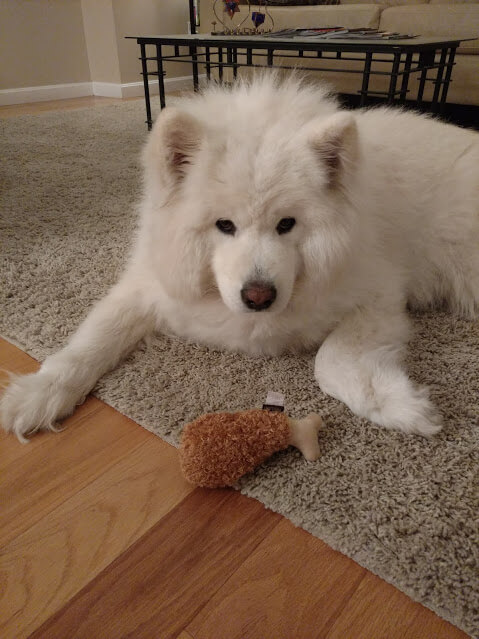
Locate an element on the screen. walls painted a light creamish gray is located at coordinates (53, 43).